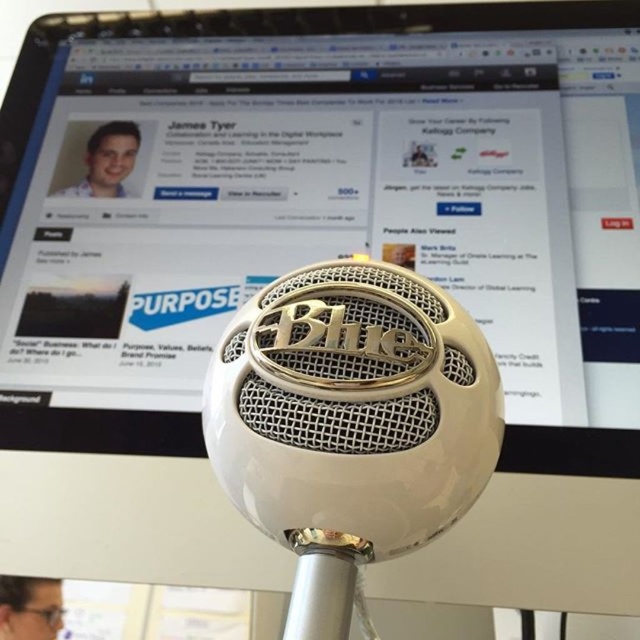
Is white glossy computer screen at center positioned behind white glossy microphone at center?

Yes, white glossy computer screen at center is behind white glossy microphone at center.

Consider the image. Can you confirm if white glossy computer screen at center is positioned to the right of white glossy microphone at center?

Incorrect, white glossy computer screen at center is not on the right side of white glossy microphone at center.

Measure the distance between point (209,44) and camera.

They are 4.33 feet apart.

The height and width of the screenshot is (640, 640). What are the coordinates of `white glossy computer screen at center` in the screenshot? It's located at (323, 205).

Who is shorter, white glossy computer screen at center or matte black glasses at lower left?

matte black glasses at lower left is shorter.

Which is behind, point (460, 83) or point (22, 598)?

Positioned behind is point (460, 83).

Is point (282, 236) farther from viewer compared to point (29, 627)?

Yes, point (282, 236) is behind point (29, 627).

Locate an element on the screen. The image size is (640, 640). white glossy computer screen at center is located at coordinates (323, 205).

How distant is white glossy computer screen at center from light blue shirt at upper left?

white glossy computer screen at center and light blue shirt at upper left are 13.76 inches apart.

Does white glossy computer screen at center have a greater width compared to light blue shirt at upper left?

Correct, the width of white glossy computer screen at center exceeds that of light blue shirt at upper left.

Is point (570, 141) more distant than point (132, 168)?

No, (570, 141) is closer to viewer.

Locate an element on the screen. white glossy computer screen at center is located at coordinates (323, 205).